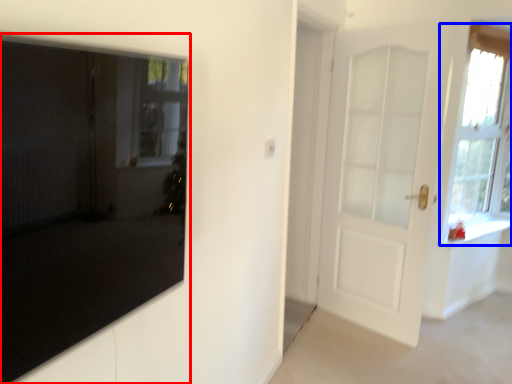
Question: Which of the following is the farthest to the observer, door (highlighted by a red box) or window (highlighted by a blue box)?

Choices:
 (A) door
 (B) window

Answer: (B)